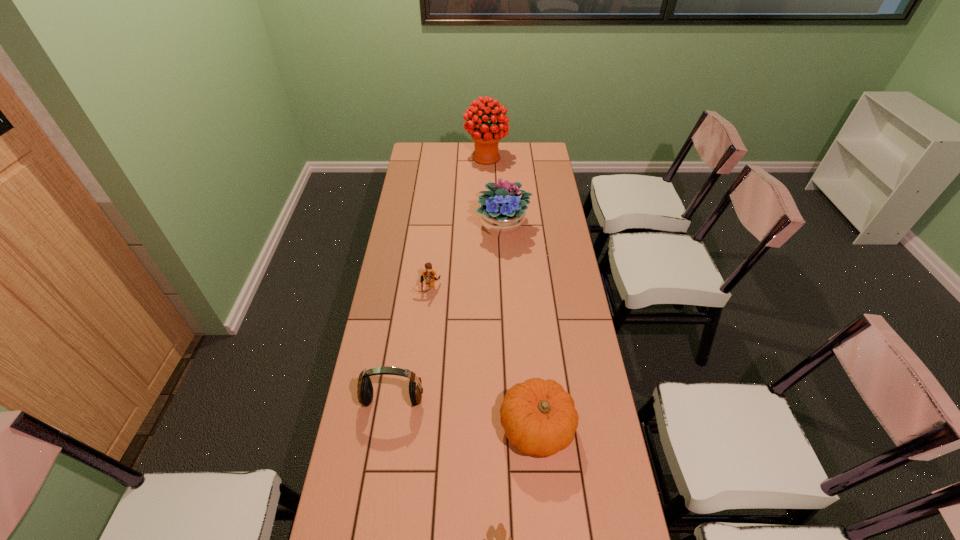
This screenshot has height=540, width=960. Find the location of `the farthest object`. the farthest object is located at coordinates (486, 137).

This screenshot has width=960, height=540. What are the coordinates of `the taller bouquet` in the screenshot? It's located at (486, 137).

At what (x,y) coordinates should I click in order to perform the action: click on the fifth nearest object. Please return your answer as a coordinate pair (x, y). The width and height of the screenshot is (960, 540). Looking at the image, I should click on (501, 211).

Where is `the nearer bouquet`? the nearer bouquet is located at coordinates (501, 211).

Where is `headset`? Image resolution: width=960 pixels, height=540 pixels. headset is located at coordinates (365, 392).

This screenshot has height=540, width=960. What are the coordinates of `pumpkin` in the screenshot? It's located at (538, 416).

Find the location of a particular element. Image resolution: width=960 pixels, height=540 pixels. Lego is located at coordinates tap(429, 274).

Find the location of a particular element. The width and height of the screenshot is (960, 540). vacant space located on the left of the farther bouquet is located at coordinates (433, 157).

You are a GUI agent. You are given a task and a screenshot of the screen. Output one action in this format:
    pyautogui.click(x=<x>, y=<y>)
    Task: Click on the vacant region located 0.120m on the right of the shorter bouquet
    
    Given the screenshot: What is the action you would take?
    pyautogui.click(x=558, y=227)

Locate an element on the screen. vacant space located 0.340m on the ear cups of the headset is located at coordinates (372, 534).